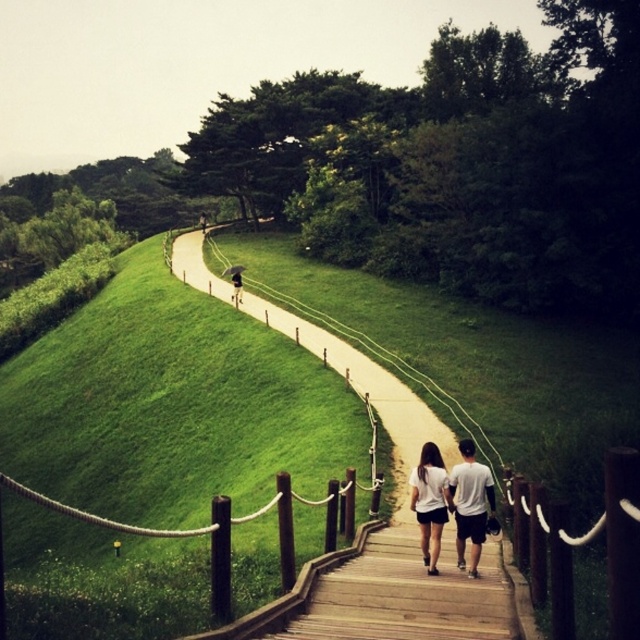
You are standing at the bottom of the wooden staircase and see the point marked at coordinates (468, 502). What object is located at that point?

The point at coordinates (468, 502) indicates the white cotton shirt at center.

You are a photographer standing at the bottom of the wooden staircase. You notice two people walking down the stairs wearing a white cotton shirt at center and dark blue jeans at center. Which clothing item appears wider from your perspective?

The white cotton shirt at center appears wider than the dark blue jeans at center from your perspective since its width surpasses the jeans.